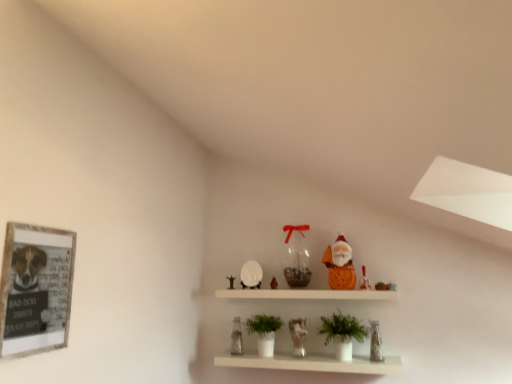
Question: Considering the positions of point (367, 283) and point (352, 354), is point (367, 283) closer or farther from the camera than point (352, 354)?

Choices:
 (A) closer
 (B) farther

Answer: (B)

Question: Based on their positions, is matte orange santa at upper center, positioned as the sixth toy in left-to-right order, located to the left or right of white matte shelf at center?

Choices:
 (A) right
 (B) left

Answer: (A)

Question: Which of these objects is positioned closest to the clear glass vase at lower center, positioned as the 7th toy in right-to-left order?

Choices:
 (A) matte glass jar at center, which appears as the 2th toy when viewed from the left
 (B) translucent glass vase at center, placed as the fifth toy when sorted from right to left
 (C) white matte shelf at center
 (D) matte orange santa at upper center, positioned as the sixth toy in left-to-right order
 (E) wooden framed poster at left

Answer: (A)

Question: Which is farther from the green matte plant at center, which is counted as the 2th houseplant, starting from the left?

Choices:
 (A) white glossy ceramic horse at center, the 4th toy when ordered from left to right
 (B) wooden framed poster at left
 (C) translucent glass vase at lower right, which appears as the 1th toy when viewed from the right
 (D) orange fabric santa at upper center, positioned as the third toy in right-to-left order
 (E) white matte shelf at center

Answer: (B)